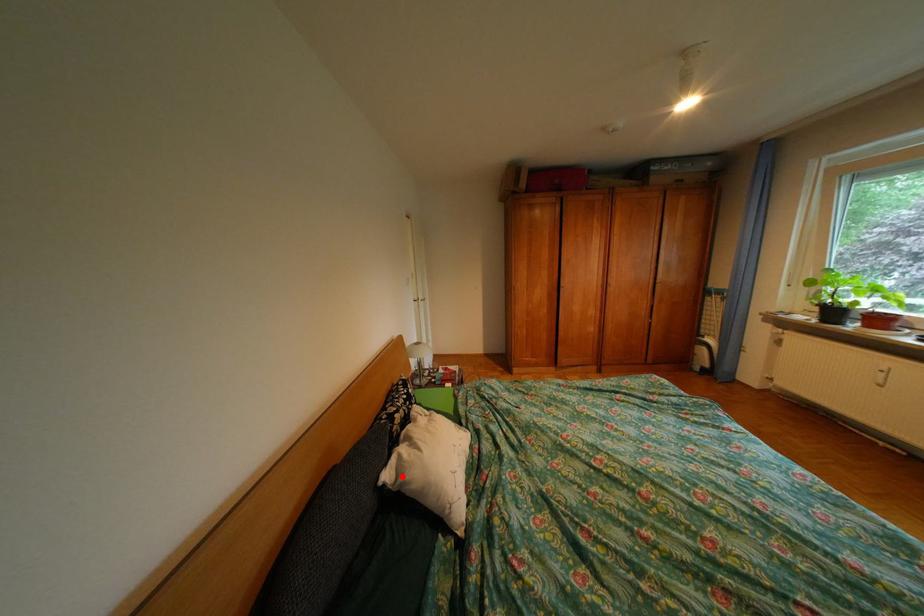
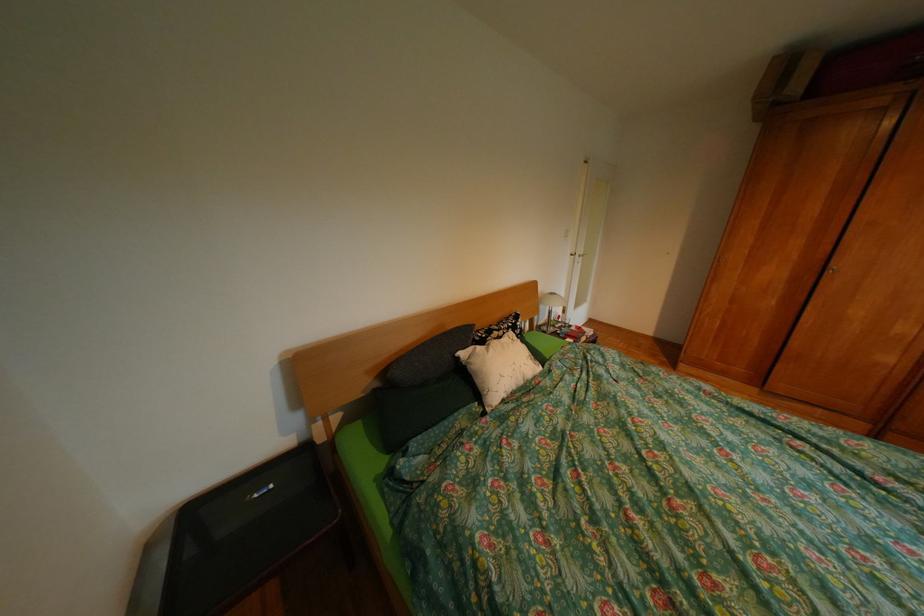
Find the pixel in the second image that matches the highlighted location in the first image.

(477, 354)